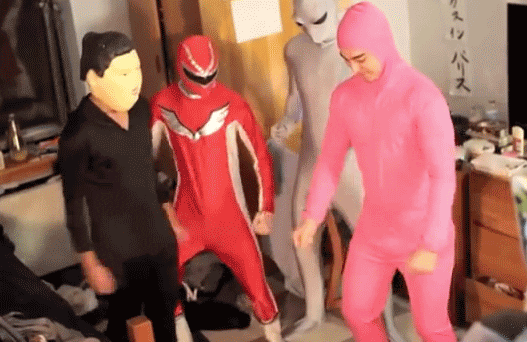
This screenshot has height=342, width=527. Identify the location of window. (44, 64).